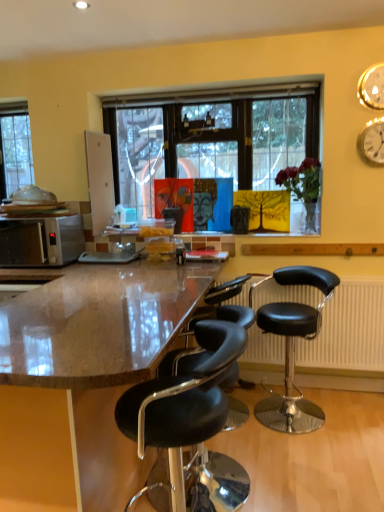
Question: Considering the relative sizes of matte orange portrait at center, arranged as the second person when viewed from the right, and brown polished granite countertop at center in the image provided, is matte orange portrait at center, arranged as the second person when viewed from the right, wider than brown polished granite countertop at center?

Choices:
 (A) no
 (B) yes

Answer: (A)

Question: Is there a large distance between matte orange portrait at center, arranged as the second person when viewed from the right, and brown polished granite countertop at center?

Choices:
 (A) yes
 (B) no

Answer: (A)

Question: From a real-world perspective, is matte orange portrait at center, arranged as the second person when viewed from the right, below brown polished granite countertop at center?

Choices:
 (A) no
 (B) yes

Answer: (A)

Question: Is brown polished granite countertop at center surrounded by matte orange portrait at center, placed as the 1th person when sorted from left to right?

Choices:
 (A) yes
 (B) no

Answer: (B)

Question: Is the surface of matte orange portrait at center, placed as the 1th person when sorted from left to right, in direct contact with brown polished granite countertop at center?

Choices:
 (A) no
 (B) yes

Answer: (A)

Question: From a real-world perspective, is black plastic radiator at lower right above or below gold metallic clock at upper right, which appears as the 2th clock when viewed from the top?

Choices:
 (A) above
 (B) below

Answer: (B)

Question: Considering the positions of black plastic radiator at lower right and gold metallic clock at upper right, which ranks as the first clock in bottom-to-top order, in the image, is black plastic radiator at lower right bigger or smaller than gold metallic clock at upper right, which ranks as the first clock in bottom-to-top order,?

Choices:
 (A) big
 (B) small

Answer: (A)

Question: From the image's perspective, is black plastic radiator at lower right above or below gold metallic clock at upper right, which appears as the 2th clock when viewed from the top?

Choices:
 (A) below
 (B) above

Answer: (A)

Question: Looking at their shapes, would you say black plastic radiator at lower right is wider or thinner than gold metallic clock at upper right, which appears as the 2th clock when viewed from the top?

Choices:
 (A) wide
 (B) thin

Answer: (A)

Question: Does point (258, 291) appear closer or farther from the camera than point (304, 159)?

Choices:
 (A) farther
 (B) closer

Answer: (B)

Question: In the image, is black plastic radiator at lower right on the left side or the right side of translucent glass vase at upper center?

Choices:
 (A) right
 (B) left

Answer: (A)

Question: From a real-world perspective, is black plastic radiator at lower right positioned above or below translucent glass vase at upper center?

Choices:
 (A) below
 (B) above

Answer: (A)

Question: Is black plastic radiator at lower right spatially inside translucent glass vase at upper center, or outside of it?

Choices:
 (A) outside
 (B) inside

Answer: (A)

Question: From the image's perspective, is clear glass window at left positioned above or below matte orange portrait at center, arranged as the second person when viewed from the right?

Choices:
 (A) above
 (B) below

Answer: (A)

Question: Is clear glass window at left to the left or to the right of matte orange portrait at center, placed as the 1th person when sorted from left to right, in the image?

Choices:
 (A) left
 (B) right

Answer: (A)